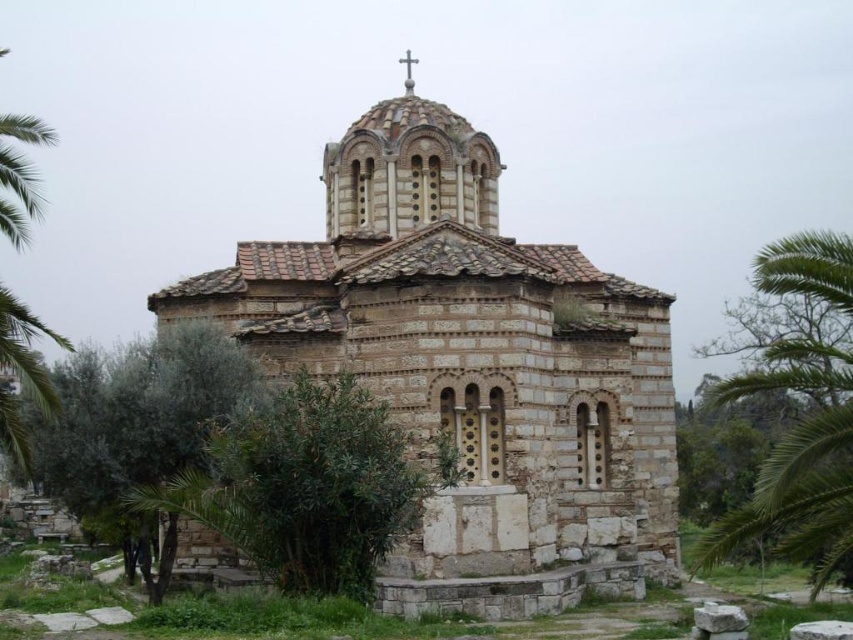
Between point (384, 179) and point (262, 476), which one is positioned behind?

The point (384, 179) is behind.

At what (x,y) coordinates should I click in order to perform the action: click on white stone church at center. Please return your answer as a coordinate pair (x, y). Looking at the image, I should click on [x=469, y=349].

How much distance is there between green leafy bush at center and white wooden cross at upper center?

green leafy bush at center is 125.25 feet from white wooden cross at upper center.

Does green leafy bush at center have a smaller size compared to white wooden cross at upper center?

Yes.

The width and height of the screenshot is (853, 640). Find the location of `green leafy bush at center`. green leafy bush at center is located at coordinates [310, 484].

Does white stone church at center have a lesser height compared to green leafy palm tree at left?

Yes, white stone church at center is shorter than green leafy palm tree at left.

Is point (508, 509) closer to camera compared to point (18, 116)?

No.

The width and height of the screenshot is (853, 640). What are the coordinates of `white stone church at center` in the screenshot? It's located at (469, 349).